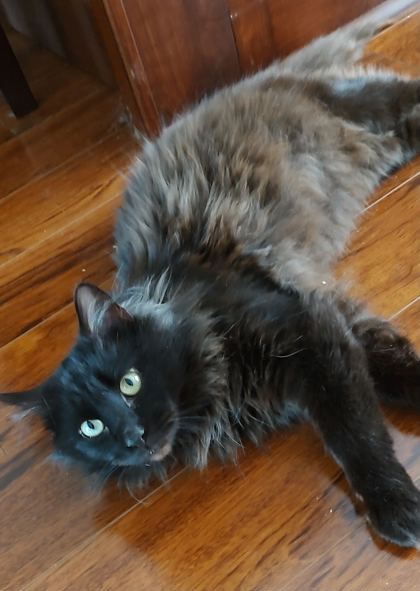
Locate an element on the screen. This screenshot has width=420, height=591. wooden floor is located at coordinates (94, 561).